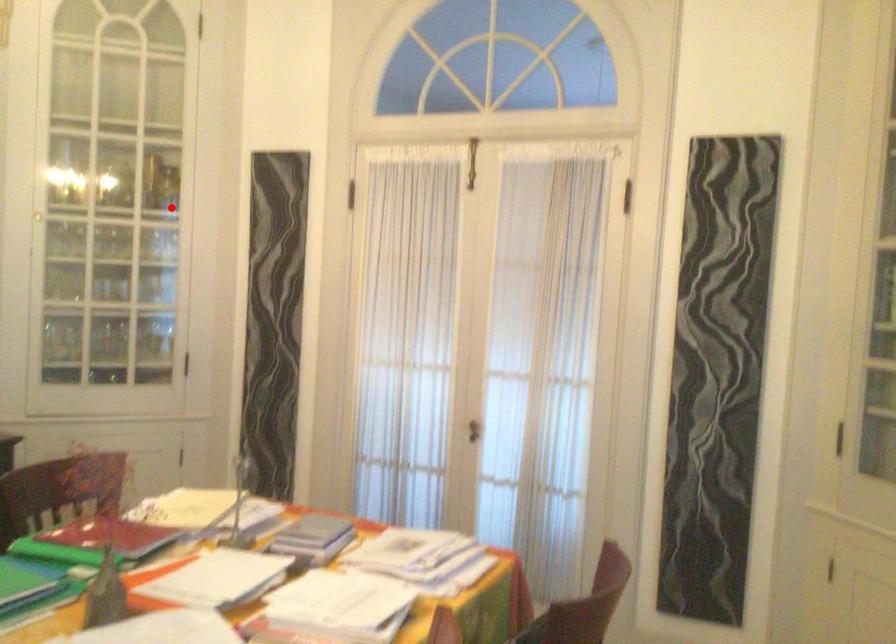
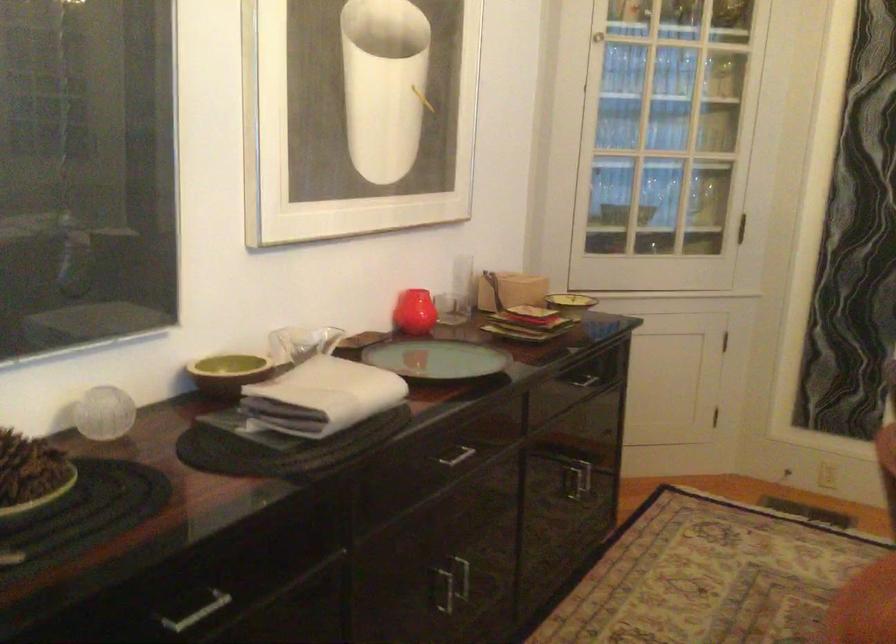
The point at the highlighted location is marked in the first image. Where is the corresponding point in the second image?

(721, 77)